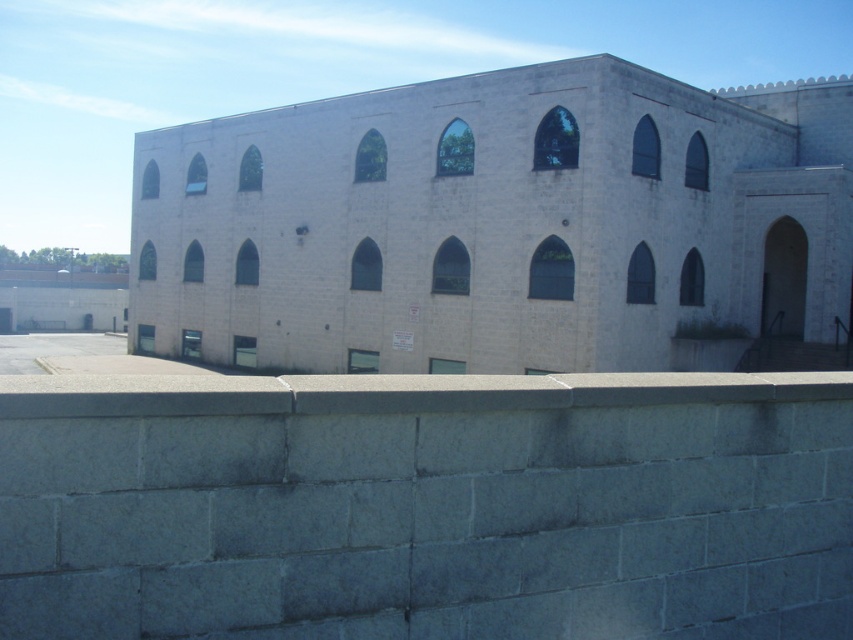
Question: Is white stone church at center thinner than gray concrete ledge at center?

Choices:
 (A) yes
 (B) no

Answer: (B)

Question: Can you confirm if gray concrete ledge at lower center is positioned below gray concrete ledge at center?

Choices:
 (A) yes
 (B) no

Answer: (A)

Question: Can you confirm if gray concrete ledge at lower center is thinner than white stone church at center?

Choices:
 (A) yes
 (B) no

Answer: (A)

Question: Which point appears closest to the camera in this image?

Choices:
 (A) tap(558, 536)
 (B) tap(445, 228)
 (C) tap(71, 396)

Answer: (C)

Question: Which of these objects is positioned farthest from the gray concrete ledge at center?

Choices:
 (A) gray concrete ledge at lower center
 (B) white stone church at center

Answer: (B)

Question: Which object appears farthest from the camera in this image?

Choices:
 (A) gray concrete ledge at center
 (B) white stone church at center
 (C) gray concrete ledge at lower center

Answer: (B)